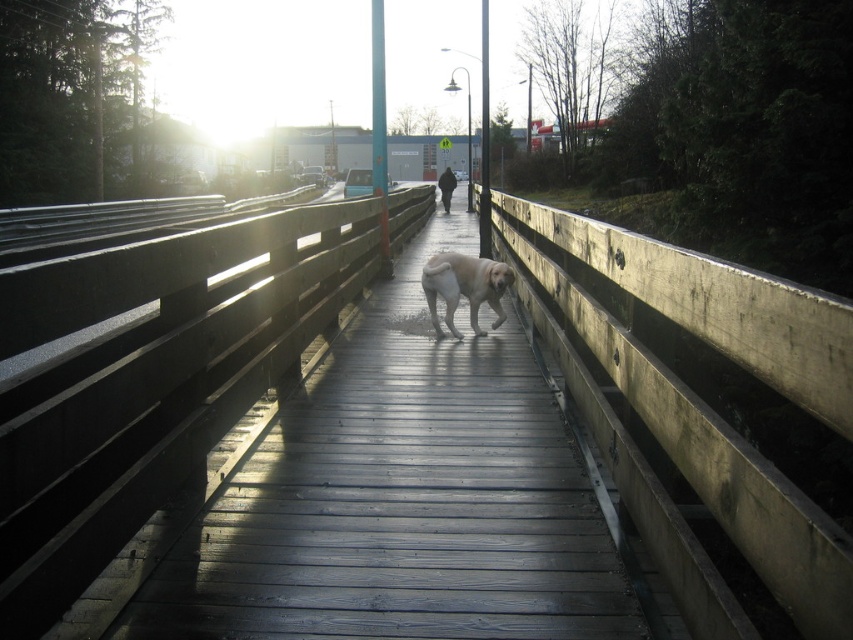
Is wooden bridge at center wider than golden fur dog at center?

Correct, the width of wooden bridge at center exceeds that of golden fur dog at center.

Does wooden bridge at center appear under golden fur dog at center?

Correct, wooden bridge at center is located below golden fur dog at center.

You are a GUI agent. You are given a task and a screenshot of the screen. Output one action in this format:
    pyautogui.click(x=<x>, y=<y>)
    Task: Click on the wooden bridge at center
    
    Given the screenshot: What is the action you would take?
    pyautogui.click(x=399, y=499)